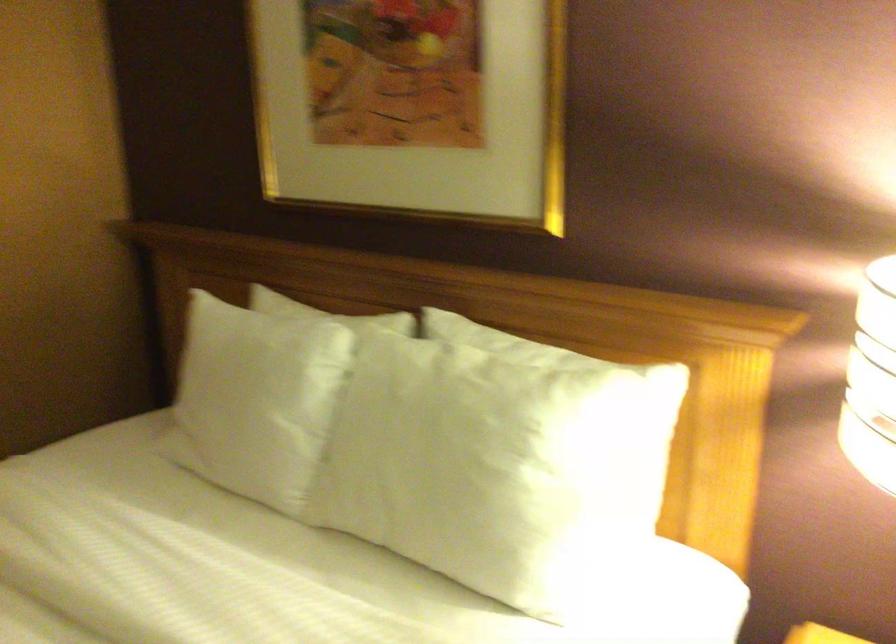
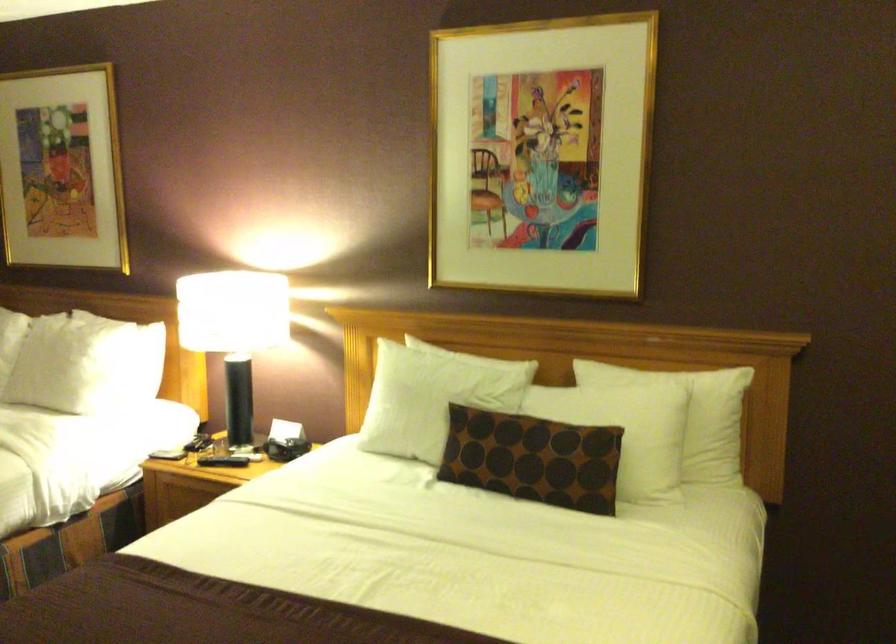
In the second image, find the point that corresponds to (510,491) in the first image.

(73, 364)